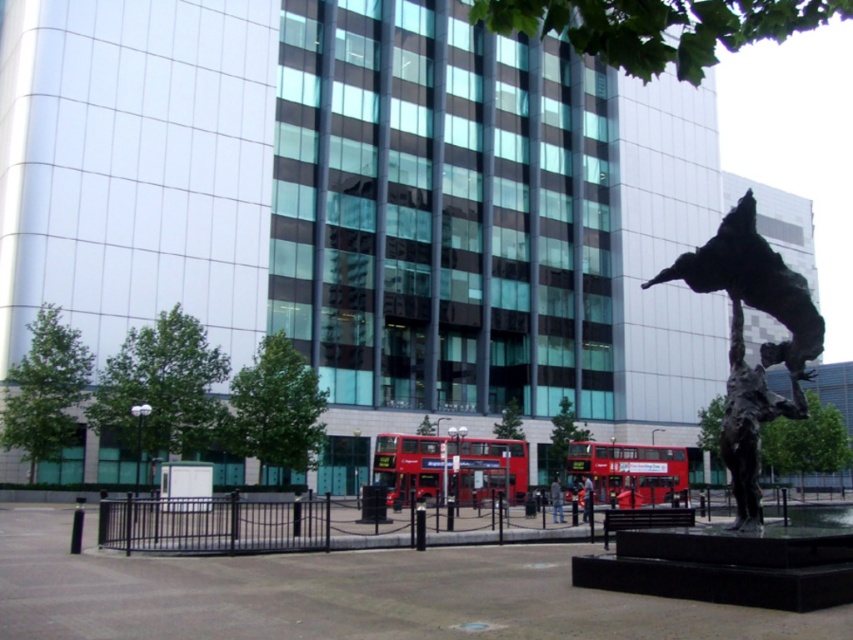
Which is more to the left, bronze metallic statue at right or bronze metallic statue at lower right?

Positioned to the left is bronze metallic statue at lower right.

Looking at this image, is bronze metallic statue at right wider than bronze metallic statue at lower right?

Indeed, bronze metallic statue at right has a greater width compared to bronze metallic statue at lower right.

Who is more distant from viewer, [747,198] or [741,381]?

The point [741,381] is more distant.

Where is `bronze metallic statue at right`? Image resolution: width=853 pixels, height=640 pixels. bronze metallic statue at right is located at coordinates (759, 346).

Is point (561, 497) positioned behind point (585, 481)?

No, it is not.

Can you confirm if dark gray fabric jacket at center is thinner than smooth bronze statue at center?

No.

At what (x,y) coordinates should I click in order to perform the action: click on dark gray fabric jacket at center. Please return your answer as a coordinate pair (x, y). The image size is (853, 640). Looking at the image, I should click on pyautogui.click(x=556, y=500).

Can you confirm if red metallic bus at center is bigger than bronze metallic statue at lower right?

Actually, red metallic bus at center might be smaller than bronze metallic statue at lower right.

Who is lower down, red metallic bus at center or bronze metallic statue at lower right?

Positioned lower is red metallic bus at center.

Find the location of a particular element. This screenshot has height=640, width=853. red metallic bus at center is located at coordinates (448, 467).

I want to click on red metallic bus at center, so click(448, 467).